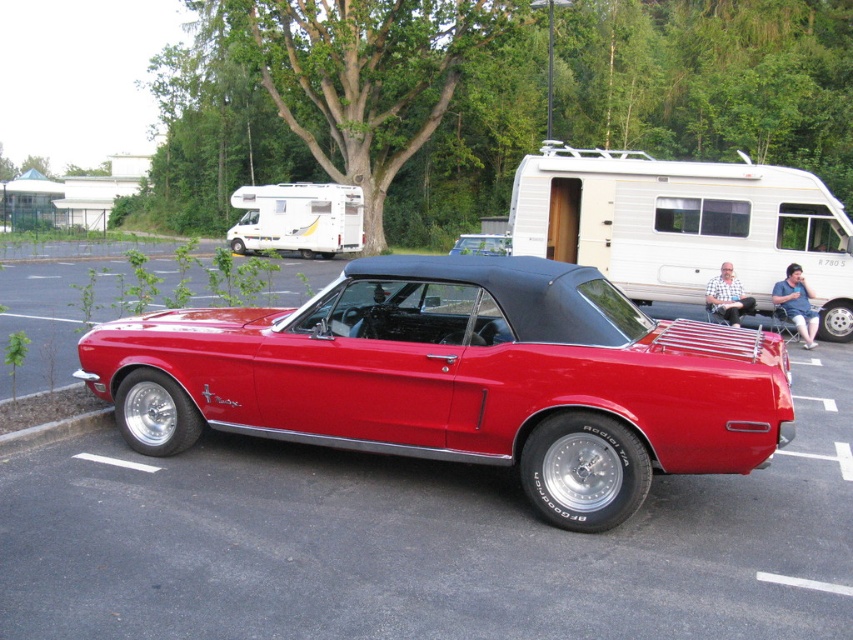
You are standing in the parking lot and want to locate two specific points on the image. The first point is at coordinates point (723,408) and the second is at point (846,262). Which of these two points is closer to you?

Point (723,408) is closer to the viewer than point (846,262).

You are a delivery person trying to load a package onto the roof of the shiny red convertible at center. The package requires 2 meters of vertical clearance. Can you safely place it there without hitting the white plastic camper at center?

The shiny red convertible at center has a lesser height compared to the white plastic camper at center, so there is enough vertical clearance to safely place the package on the roof of the shiny red convertible at center without hitting the white plastic camper at center.

You are planning to park your car in a parking spot that can only accommodate vehicles taking up to the space of the shiny red convertible at center. Can the white plastic camper at center fit in this parking spot?

The shiny red convertible at center occupies less space than the white plastic camper at center, so the white plastic camper at center is larger and would not fit in a parking spot designed for the size of the shiny red convertible at center.